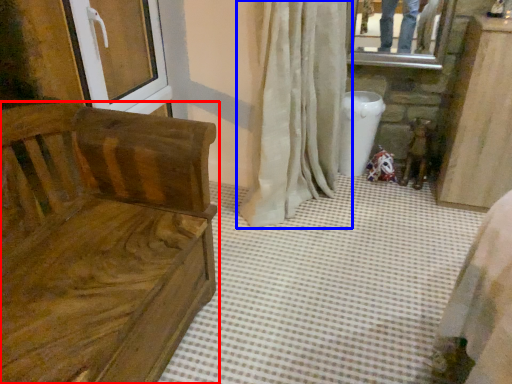
Question: Which object is further to the camera taking this photo, furniture (highlighted by a red box) or curtain (highlighted by a blue box)?

Choices:
 (A) furniture
 (B) curtain

Answer: (B)